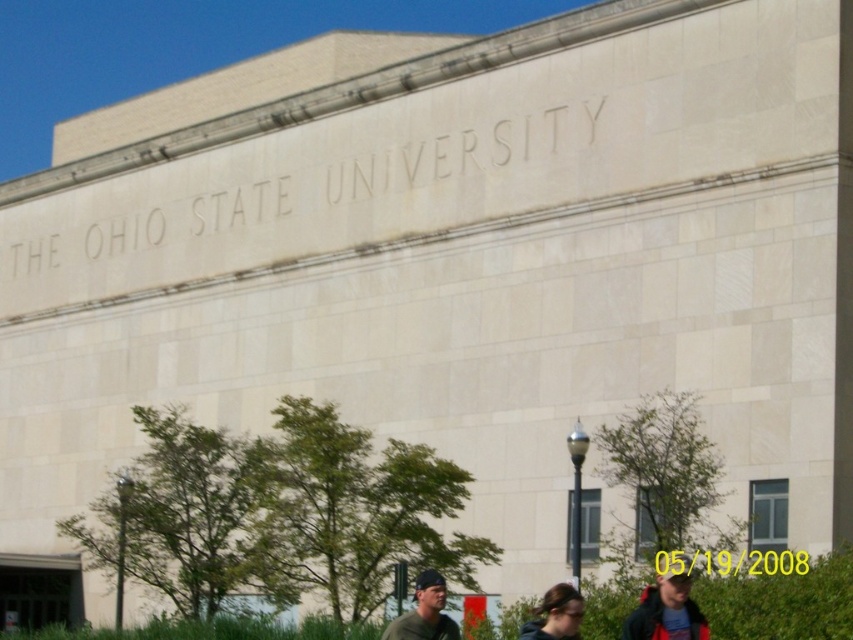
Question: Which of the following is the farthest from the observer?

Choices:
 (A) green leafy hedge at lower center
 (B) dark brown hair at lower center
 (C) matte black jacket at lower right

Answer: (A)

Question: Is matte black jacket at lower right bigger than dark brown hair at lower center?

Choices:
 (A) no
 (B) yes

Answer: (A)

Question: Does matte black jacket at lower right have a smaller size compared to matte green shirt at lower center?

Choices:
 (A) no
 (B) yes

Answer: (A)

Question: Which of the following is the closest to the observer?

Choices:
 (A) (538, 620)
 (B) (596, 621)
 (C) (680, 627)

Answer: (C)

Question: Where is matte green shirt at lower center located in relation to dark brown hair at lower center in the image?

Choices:
 (A) left
 (B) right

Answer: (A)

Question: Which object is positioned closest to the matte black jacket at lower right?

Choices:
 (A) dark brown hair at lower center
 (B) green leafy hedge at lower center
 (C) matte green shirt at lower center

Answer: (A)